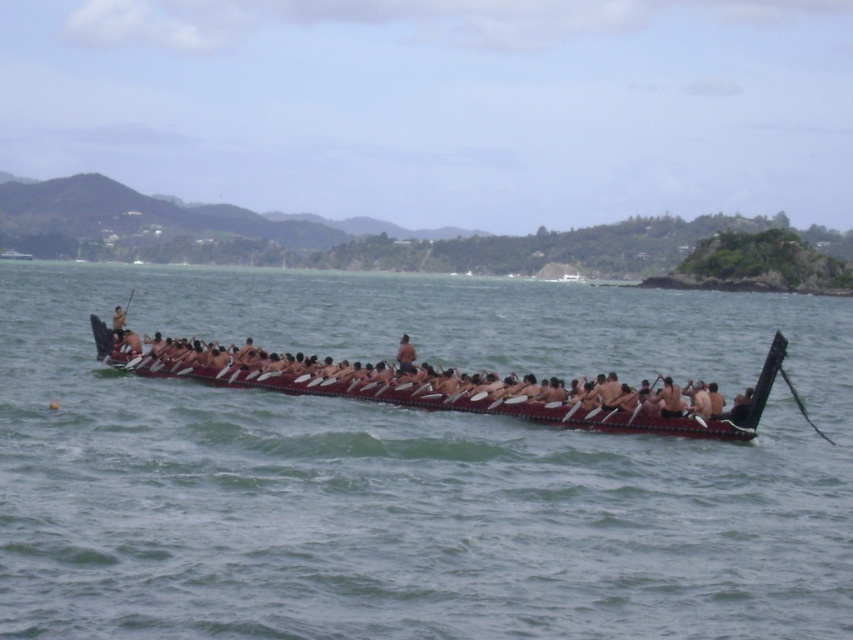
Is brown wooden canoe at center closer to camera compared to wooden polished paddle at center?

Yes, it is.

How much distance is there between brown wooden canoe at center and wooden polished paddle at center?

54.99 meters

What do you see at coordinates (412, 467) in the screenshot? I see `brown wooden canoe at center` at bounding box center [412, 467].

I want to click on brown wooden canoe at center, so click(x=412, y=467).

Can you confirm if polished dark wood canoe at center is bigger than wooden polished paddle at center?

Correct, polished dark wood canoe at center is larger in size than wooden polished paddle at center.

Who is more distant from viewer, (x=184, y=365) or (x=575, y=403)?

Point (x=184, y=365)

The height and width of the screenshot is (640, 853). Find the location of `polished dark wood canoe at center`. polished dark wood canoe at center is located at coordinates [x=444, y=387].

Who is positioned more to the right, brown wooden canoe at center or polished dark wood canoe at center?

From the viewer's perspective, brown wooden canoe at center appears more on the right side.

Between point (463, 419) and point (281, 358), which one is positioned in front?

Point (463, 419) is in front.

The width and height of the screenshot is (853, 640). Find the location of `brown wooden canoe at center`. brown wooden canoe at center is located at coordinates (412, 467).